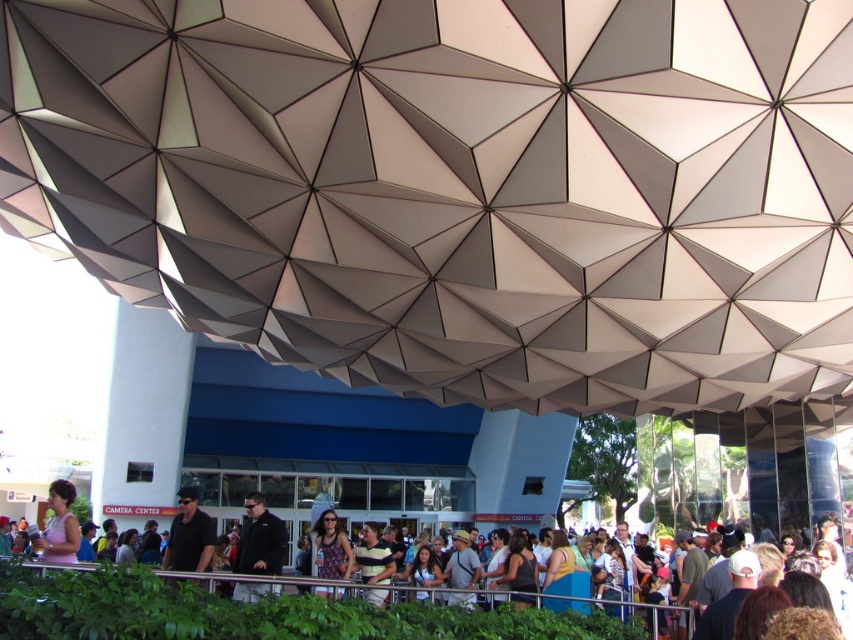
Who is shorter, dark gray fabric shirt at center or printed fabric dress at center?

dark gray fabric shirt at center

Is point (187, 544) less distant than point (329, 528)?

Yes, it is.

Locate an element on the screen. This screenshot has width=853, height=640. dark gray fabric shirt at center is located at coordinates 189,536.

Locate an element on the screen. The width and height of the screenshot is (853, 640). dark gray fabric shirt at center is located at coordinates (189, 536).

Which of these two, matte black shirt at center or dark gray fabric shirt at center, stands taller?

matte black shirt at center is taller.

Describe the element at coordinates (252, 612) in the screenshot. This screenshot has height=640, width=853. I see `matte black shirt at center` at that location.

Locate an element on the screen. The width and height of the screenshot is (853, 640). matte black shirt at center is located at coordinates [252, 612].

Which is in front, point (361, 636) or point (257, 582)?

Point (361, 636) is in front.

Can you confirm if matte black shirt at center is positioned below black matte jacket at center?

Actually, matte black shirt at center is above black matte jacket at center.

The width and height of the screenshot is (853, 640). What are the coordinates of `matte black shirt at center` in the screenshot? It's located at (252, 612).